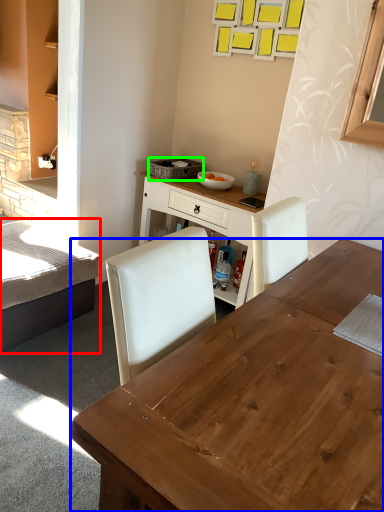
Question: Which object is the farthest from bed (highlighted by a red box)? Choose among these: desk (highlighted by a blue box) or picnic basket (highlighted by a green box).

Choices:
 (A) desk
 (B) picnic basket

Answer: (A)